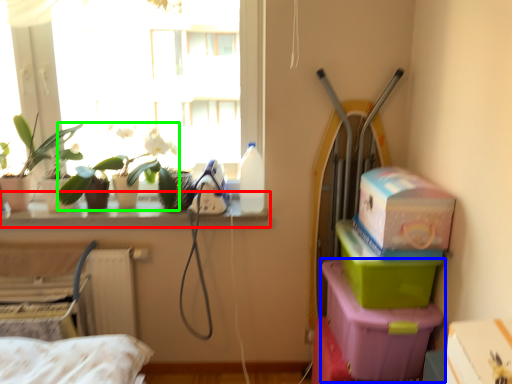
Question: Which object is positioned farthest from window sill (highlighted by a red box)? Select from box (highlighted by a blue box) and plant (highlighted by a green box).

Choices:
 (A) box
 (B) plant

Answer: (A)